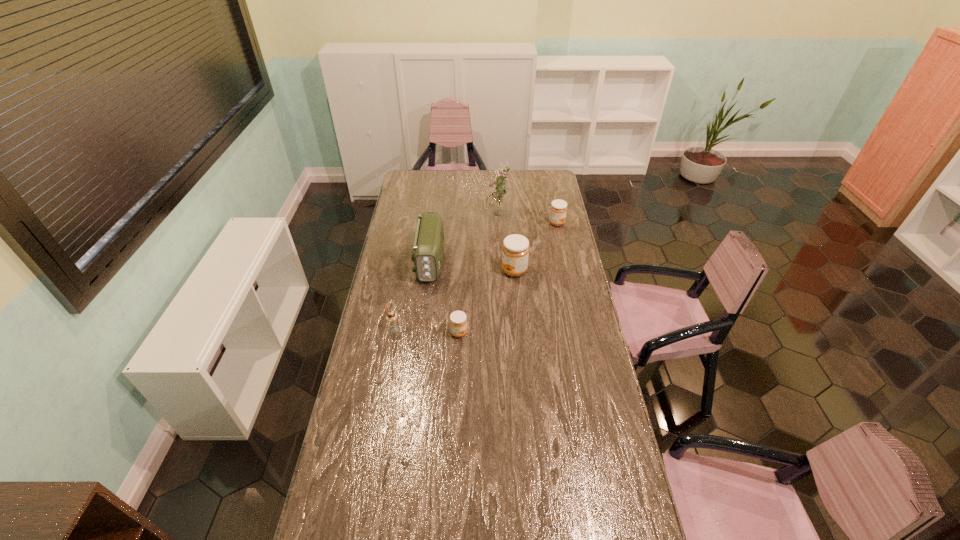
The height and width of the screenshot is (540, 960). I want to click on object that is positioned at the right edge, so click(x=558, y=209).

In the image, there is a desktop. What are the coordinates of `vacant space at the near edge` in the screenshot? It's located at (409, 537).

In the image, there is a desktop. At what (x,y) coordinates should I click in order to perform the action: click on vacant region at the left edge. Please return your answer as a coordinate pair (x, y). The image size is (960, 540). Looking at the image, I should click on (396, 269).

This screenshot has width=960, height=540. In the image, there is a desktop. In order to click on vacant space at the right edge in this screenshot , I will do `click(549, 207)`.

Find the location of `free space at the far right corner of the desktop`. free space at the far right corner of the desktop is located at coordinates (540, 188).

At what (x,y) coordinates should I click in order to perform the action: click on vacant area that lies between the second object from left to right and the second nearest jam. Please return your answer as a coordinate pair (x, y). This screenshot has width=960, height=540. Looking at the image, I should click on (472, 266).

I want to click on free spot between the second nearest jam and the leftmost object, so click(454, 300).

Image resolution: width=960 pixels, height=540 pixels. What are the coordinates of `free spot between the shortest jam and the second jam from left to right` in the screenshot? It's located at (487, 302).

The width and height of the screenshot is (960, 540). Identify the location of free spot between the radio_receiver and the second farthest jam. (472, 266).

This screenshot has width=960, height=540. I want to click on blank region between the rightmost object and the bouquet, so click(527, 220).